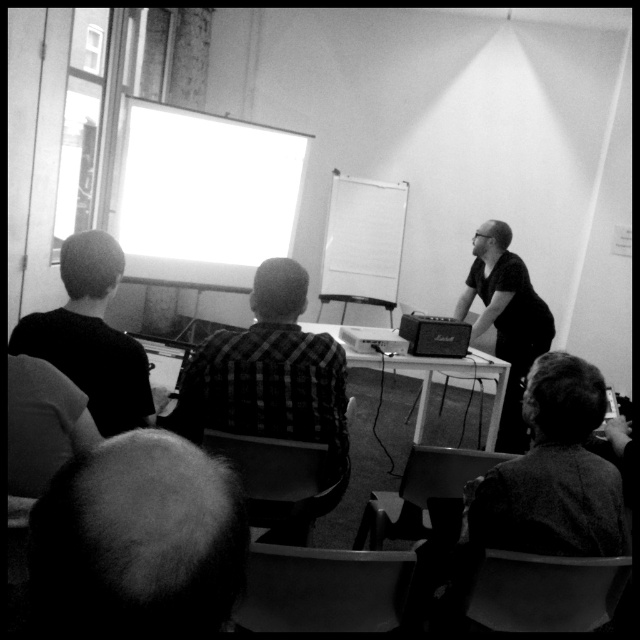
Question: Among these objects, which one is farthest from the camera?

Choices:
 (A) dark hair at left
 (B) smooth fabric jacket at lower right

Answer: (A)

Question: Which point is closer to the camera taking this photo?

Choices:
 (A) (102, 296)
 (B) (506, 422)
 (C) (77, 600)

Answer: (C)

Question: Which point is farther to the camera?

Choices:
 (A) dark hair at left
 (B) dark fabric shirt at center
 (C) white matte projection screen at center
 (D) checkered fabric shirt at center

Answer: (C)

Question: Does smooth bald head at lower left have a larger size compared to white glossy projection screen at upper left?

Choices:
 (A) yes
 (B) no

Answer: (B)

Question: Does smooth bald head at lower left appear over dark fabric shirt at center?

Choices:
 (A) yes
 (B) no

Answer: (B)

Question: Is checkered fabric shirt at center above dark fabric shirt at center?

Choices:
 (A) yes
 (B) no

Answer: (B)